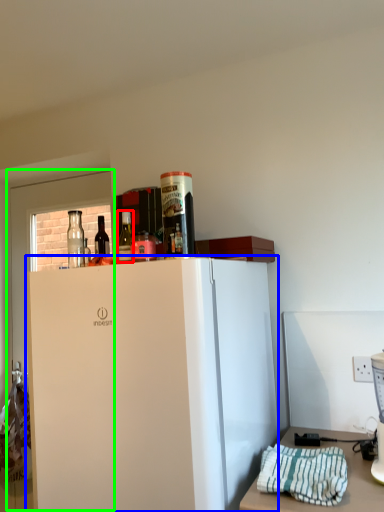
Question: Which object is the closest to the bottle (highlighted by a red box)? Choose among these: refrigerator (highlighted by a blue box) or glass door (highlighted by a green box).

Choices:
 (A) refrigerator
 (B) glass door

Answer: (A)